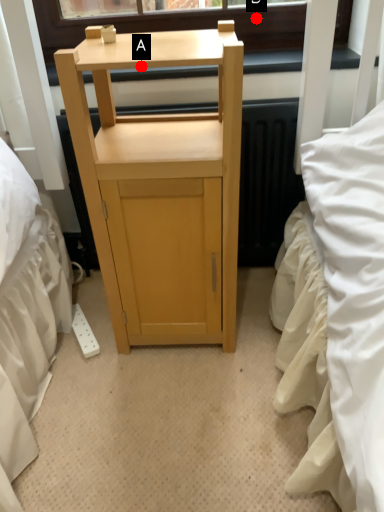
Question: Two points are circled on the image, labeled by A and B beside each circle. Among these points, which one is nearest to the camera?

Choices:
 (A) A is closer
 (B) B is closer

Answer: (A)